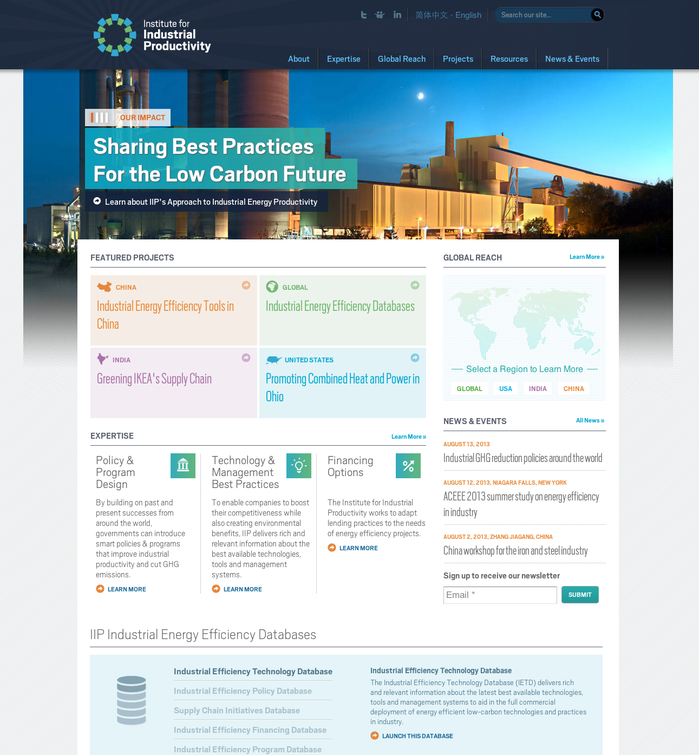
In order to click on map art in this screenshot , I will do `click(535, 313)`.